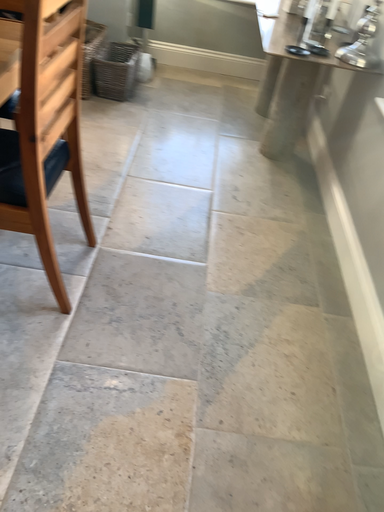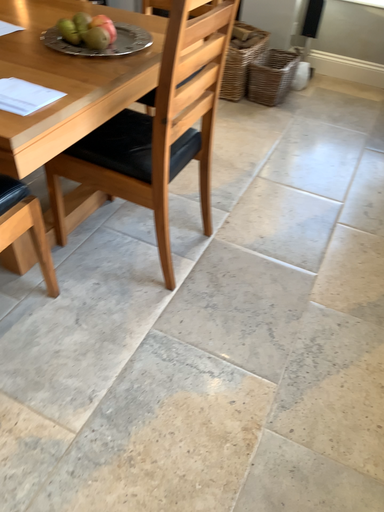
Question: Which way did the camera rotate in the video?

Choices:
 (A) rotated left
 (B) rotated right

Answer: (A)